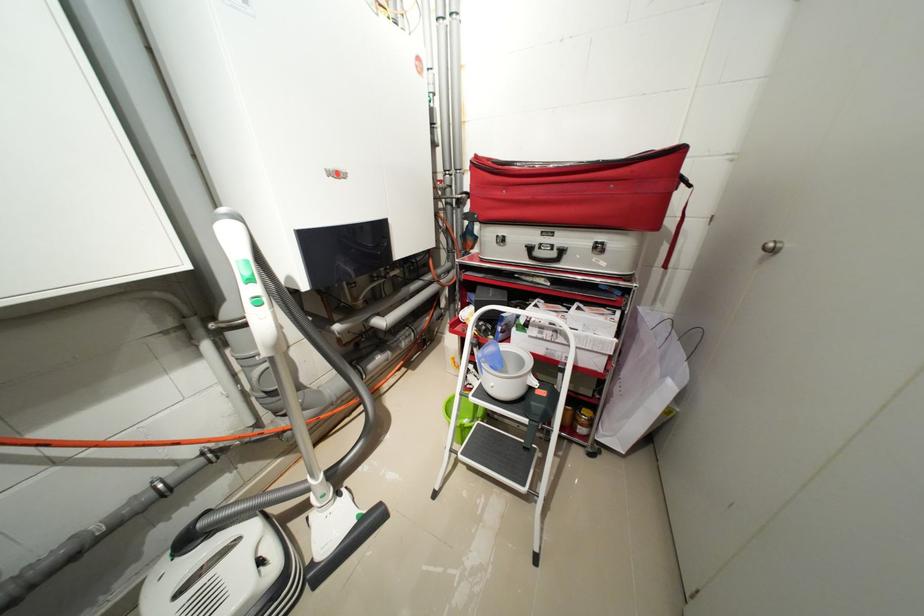
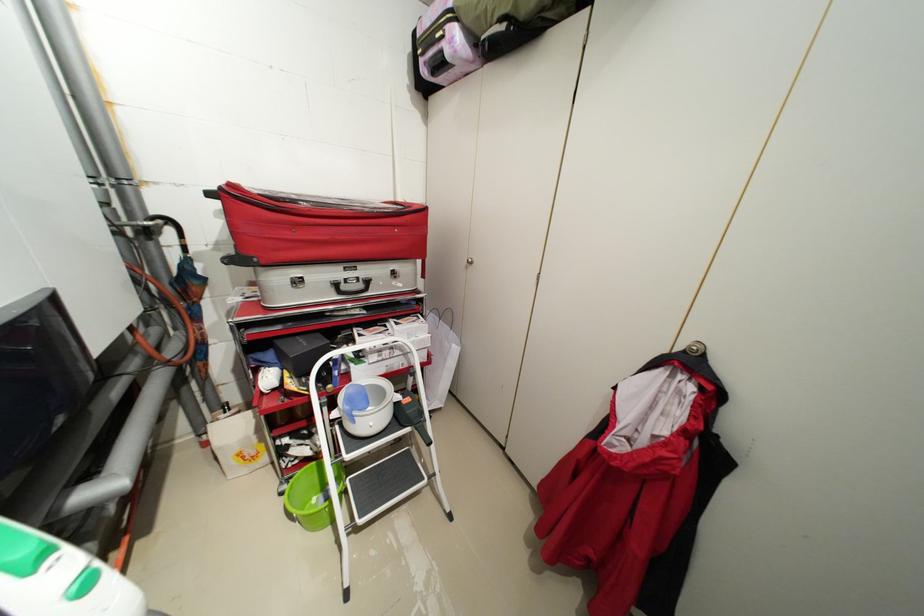
Question: The camera is either moving clockwise (left) or counter-clockwise (right) around the object. The first image is from the beginning of the video and the second image is from the end. Is the camera moving left or right when shooting the video?

Choices:
 (A) Left
 (B) Right

Answer: (A)